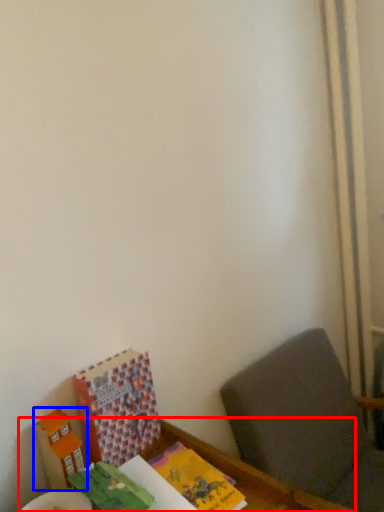
Question: Which object appears farthest to the camera in this image, table (highlighted by a red box) or cardboard box (highlighted by a blue box)?

Choices:
 (A) table
 (B) cardboard box

Answer: (B)